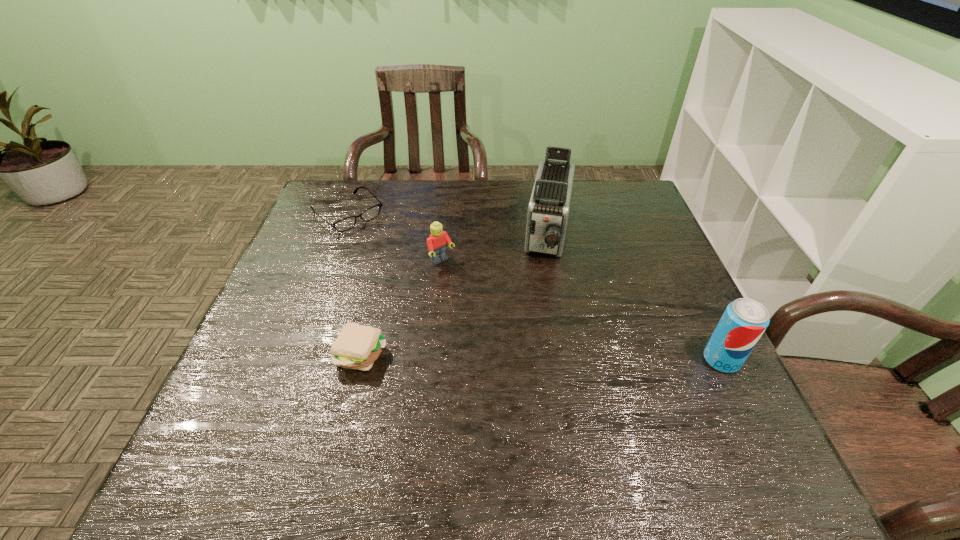
Locate an element on the screen. The image size is (960, 540). blank area located 0.340m on the face of the Lego is located at coordinates (535, 352).

Locate an element on the screen. Image resolution: width=960 pixels, height=540 pixels. blank space located 0.190m on the face of the Lego is located at coordinates (493, 311).

I want to click on blank space located on the face of the Lego, so click(x=476, y=294).

Locate an element on the screen. This screenshot has height=540, width=960. vacant region located at the lens of the second object from right to left is located at coordinates (539, 327).

The image size is (960, 540). I want to click on vacant space positioned 0.060m at the lens of the second object from right to left, so click(x=546, y=286).

Locate an element on the screen. Image resolution: width=960 pixels, height=540 pixels. vacant region located at the lens of the second object from right to left is located at coordinates (541, 309).

Identify the location of free space located on the front-facing side of the spectacles. (400, 261).

Where is `vacant space located on the front-facing side of the spectacles`? This screenshot has width=960, height=540. vacant space located on the front-facing side of the spectacles is located at coordinates (447, 305).

The image size is (960, 540). I want to click on vacant space located 0.310m on the front-facing side of the spectacles, so point(428,287).

Where is `camcorder situated at the far edge`? camcorder situated at the far edge is located at coordinates (548, 210).